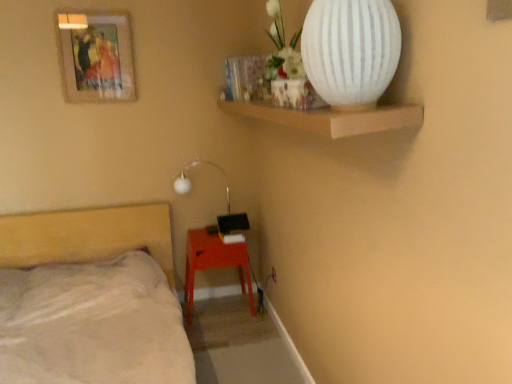
Question: Is white plastic electric outlet at lower center outside of beige fabric bed at lower left?

Choices:
 (A) yes
 (B) no

Answer: (A)

Question: Can you confirm if white plastic electric outlet at lower center is wider than beige fabric bed at lower left?

Choices:
 (A) no
 (B) yes

Answer: (A)

Question: Does white plastic electric outlet at lower center appear on the left side of beige fabric bed at lower left?

Choices:
 (A) yes
 (B) no

Answer: (B)

Question: From the image's perspective, is white plastic electric outlet at lower center located beneath beige fabric bed at lower left?

Choices:
 (A) no
 (B) yes

Answer: (A)

Question: Does white plastic electric outlet at lower center have a smaller size compared to beige fabric bed at lower left?

Choices:
 (A) yes
 (B) no

Answer: (A)

Question: From the image's perspective, is white matte vase at upper right above or below beige fabric bed at lower left?

Choices:
 (A) above
 (B) below

Answer: (A)

Question: Based on their positions, is white matte vase at upper right located to the left or right of beige fabric bed at lower left?

Choices:
 (A) right
 (B) left

Answer: (A)

Question: Considering their positions, is white matte vase at upper right located in front of or behind beige fabric bed at lower left?

Choices:
 (A) behind
 (B) front

Answer: (A)

Question: Is white matte vase at upper right taller or shorter than beige fabric bed at lower left?

Choices:
 (A) short
 (B) tall

Answer: (A)

Question: Is point (269, 276) closer or farther from the camera than point (342, 107)?

Choices:
 (A) closer
 (B) farther

Answer: (B)

Question: Relative to white matte vase at upper right, is white plastic electric outlet at lower center in front or behind?

Choices:
 (A) behind
 (B) front

Answer: (A)

Question: From the image's perspective, is white plastic electric outlet at lower center located above or below white matte vase at upper right?

Choices:
 (A) above
 (B) below

Answer: (B)

Question: Considering the positions of white plastic electric outlet at lower center and white matte vase at upper right in the image, is white plastic electric outlet at lower center taller or shorter than white matte vase at upper right?

Choices:
 (A) short
 (B) tall

Answer: (A)

Question: Does point (196, 231) appear closer or farther from the camera than point (179, 193)?

Choices:
 (A) farther
 (B) closer

Answer: (A)

Question: Is matte orange table at lower center taller or shorter than white matte lamp at upper center?

Choices:
 (A) short
 (B) tall

Answer: (B)